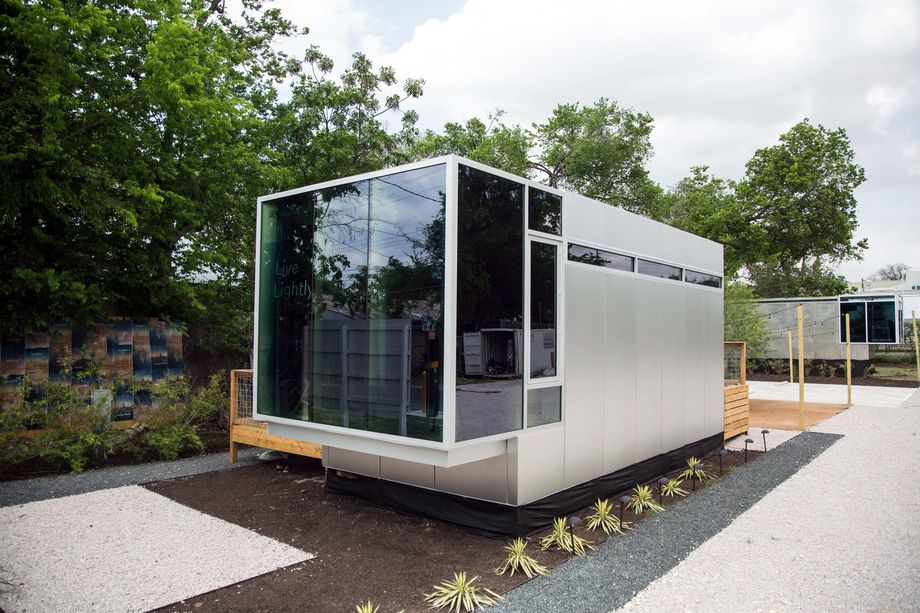
Locate an element on the screen. The height and width of the screenshot is (613, 920). windows is located at coordinates (423, 360), (343, 343), (274, 330), (495, 349), (541, 341), (604, 263), (661, 263), (697, 275).